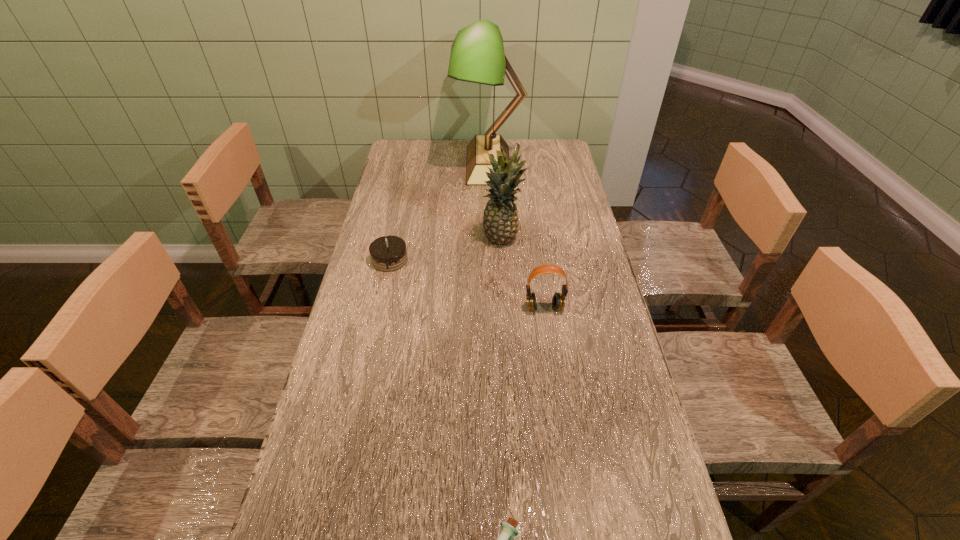
Image resolution: width=960 pixels, height=540 pixels. What are the coordinates of `blank area located 0.270m on the ear cups of the third tallest object` in the screenshot? It's located at (558, 402).

This screenshot has width=960, height=540. I want to click on vacant space situated on the front of the chocolate cake, so click(x=378, y=314).

The width and height of the screenshot is (960, 540). Find the location of `object situated at the far edge`. object situated at the far edge is located at coordinates (477, 55).

Image resolution: width=960 pixels, height=540 pixels. Identify the location of object at the left edge. (388, 253).

This screenshot has height=540, width=960. I want to click on object present at the right edge, so click(x=558, y=301).

This screenshot has width=960, height=540. In the image, there is a desktop. What are the coordinates of `vacant space at the left edge` in the screenshot? It's located at (374, 376).

The image size is (960, 540). What are the coordinates of `free space at the right edge of the desktop` in the screenshot? It's located at (607, 322).

The height and width of the screenshot is (540, 960). Find the location of `free space at the far left corner of the desktop`. free space at the far left corner of the desktop is located at coordinates (397, 150).

Find the location of a particular element. The image size is (960, 540). free spot at the far right corner of the desktop is located at coordinates (552, 148).

Where is `free point between the headset and the table lamp`? The height and width of the screenshot is (540, 960). free point between the headset and the table lamp is located at coordinates (516, 236).